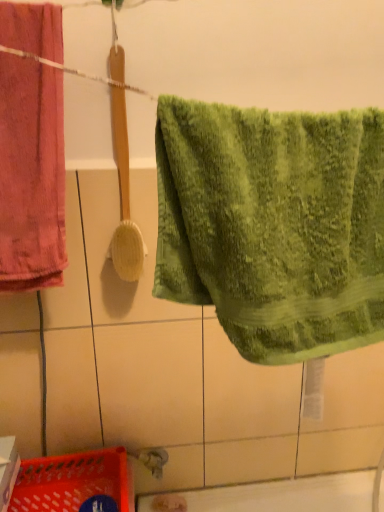
Question: From a real-world perspective, is wooden textured brush at center physically located above or below green textured towel at center, placed as the 1th towel when sorted from right to left?

Choices:
 (A) above
 (B) below

Answer: (A)

Question: Choose the correct answer: Is wooden textured brush at center inside green textured towel at center, which is counted as the 2th towel, starting from the back, or outside it?

Choices:
 (A) outside
 (B) inside

Answer: (A)

Question: Considering the real-world distances, which object is farthest from the wooden textured brush at center?

Choices:
 (A) velvety pink towel at left, acting as the 1th towel starting from the left
 (B) green textured towel at center, which ranks as the second towel in left-to-right order
 (C) translucent plastic basket at lower left

Answer: (C)

Question: Which of these objects is positioned closest to the velvety pink towel at left, which ranks as the 1th towel in back-to-front order?

Choices:
 (A) green textured towel at center, which appears as the first towel when viewed from the front
 (B) wooden textured brush at center
 (C) translucent plastic basket at lower left

Answer: (B)